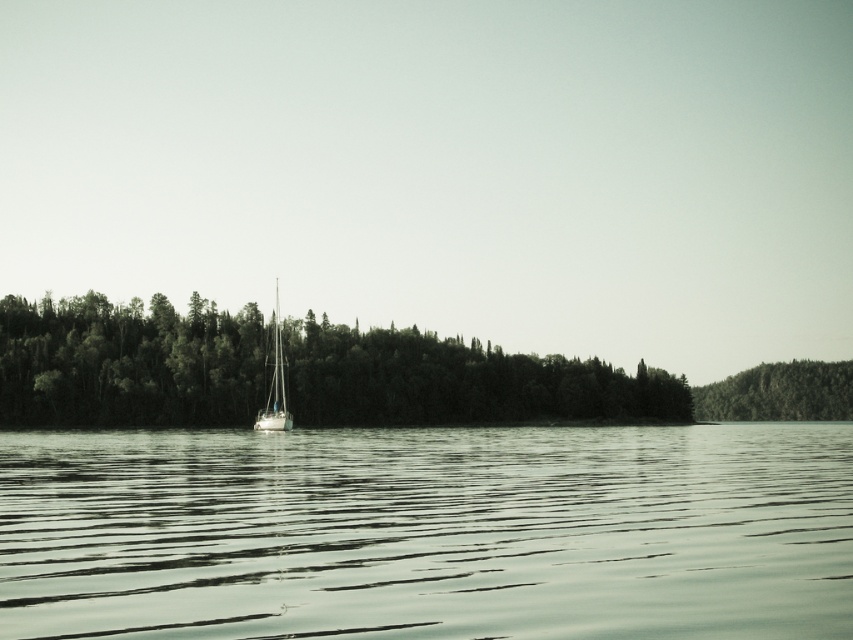
Does green matte trees at center have a lesser width compared to white glossy sailboat at center?

No, green matte trees at center is not thinner than white glossy sailboat at center.

Is point (109, 324) positioned after point (277, 404)?

Yes, it is.

Is point (439, 355) in front of point (282, 396)?

No, it is behind (282, 396).

Find the location of a particular element. The height and width of the screenshot is (640, 853). green matte trees at center is located at coordinates (129, 362).

Who is shorter, green textured forest at right or white glossy sailboat at center?

green textured forest at right

Looking at this image, how much distance is there between green textured forest at right and white glossy sailboat at center?

546.60 feet

This screenshot has width=853, height=640. What do you see at coordinates (779, 392) in the screenshot?
I see `green textured forest at right` at bounding box center [779, 392].

You are a GUI agent. You are given a task and a screenshot of the screen. Output one action in this format:
    pyautogui.click(x=<x>, y=<y>)
    Task: Click on the green textured forest at right
    This screenshot has height=640, width=853.
    Given the screenshot: What is the action you would take?
    pyautogui.click(x=779, y=392)

Is clear water at center smaller than green matte trees at center?

Correct, clear water at center occupies less space than green matte trees at center.

Is clear water at center to the right of green matte trees at center from the viewer's perspective?

Correct, you'll find clear water at center to the right of green matte trees at center.

Between point (112, 625) and point (113, 385), which one is positioned behind?

Point (113, 385)

Identify the location of clear water at center. This screenshot has width=853, height=640. (428, 531).